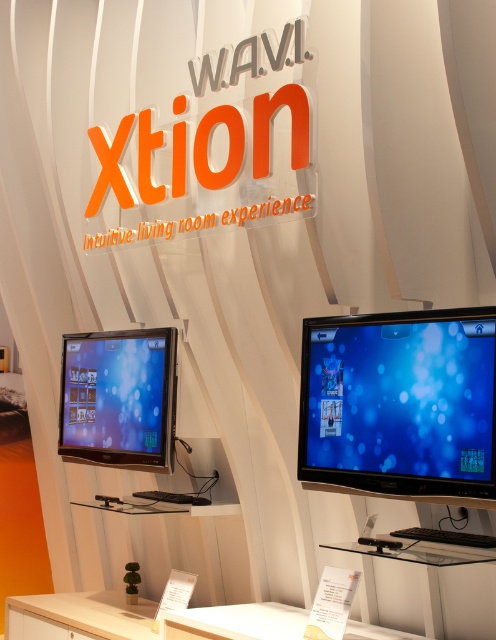
Question: Is glossy black monitor at center to the right of satin black monitor at lower left from the viewer's perspective?

Choices:
 (A) yes
 (B) no

Answer: (A)

Question: Does glossy black monitor at center have a greater width compared to satin black monitor at lower left?

Choices:
 (A) yes
 (B) no

Answer: (B)

Question: Is glossy black monitor at center to the left of satin black monitor at lower left from the viewer's perspective?

Choices:
 (A) no
 (B) yes

Answer: (A)